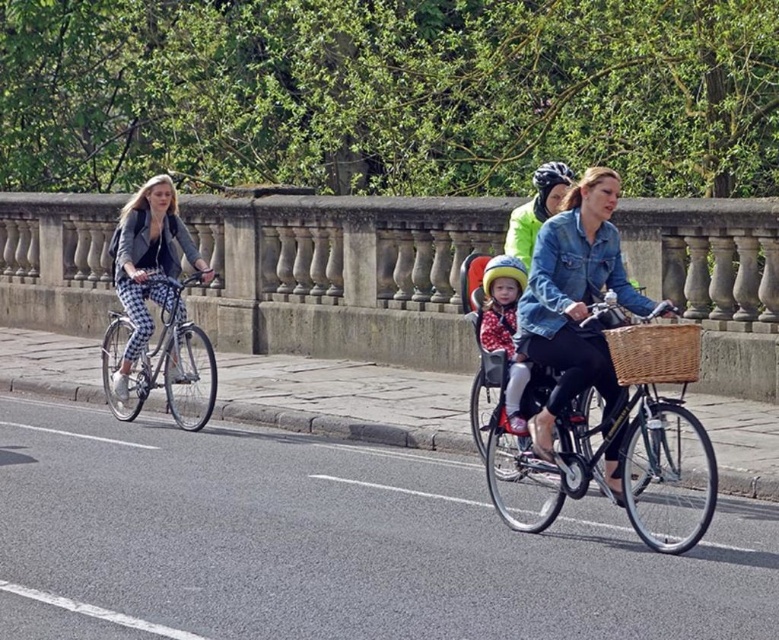
Question: Can you confirm if polka dot fabric baby carrier at center is smaller than matte black helmet at upper center?

Choices:
 (A) no
 (B) yes

Answer: (A)

Question: Which point appears farthest from the camera in this image?

Choices:
 (A) (598, 182)
 (B) (490, 308)

Answer: (B)

Question: Does denim jacket at center have a lesser width compared to polka dot fabric baby carrier at center?

Choices:
 (A) yes
 (B) no

Answer: (B)

Question: Which is nearer to the matte black bicycle at center?

Choices:
 (A) matte black bicycle at left
 (B) matte black helmet at upper center

Answer: (B)

Question: Does matte black jacket at left appear under woven brown basket at center?

Choices:
 (A) no
 (B) yes

Answer: (A)

Question: Which point appears farthest from the camera in this image?

Choices:
 (A) (508, 416)
 (B) (192, 356)

Answer: (B)